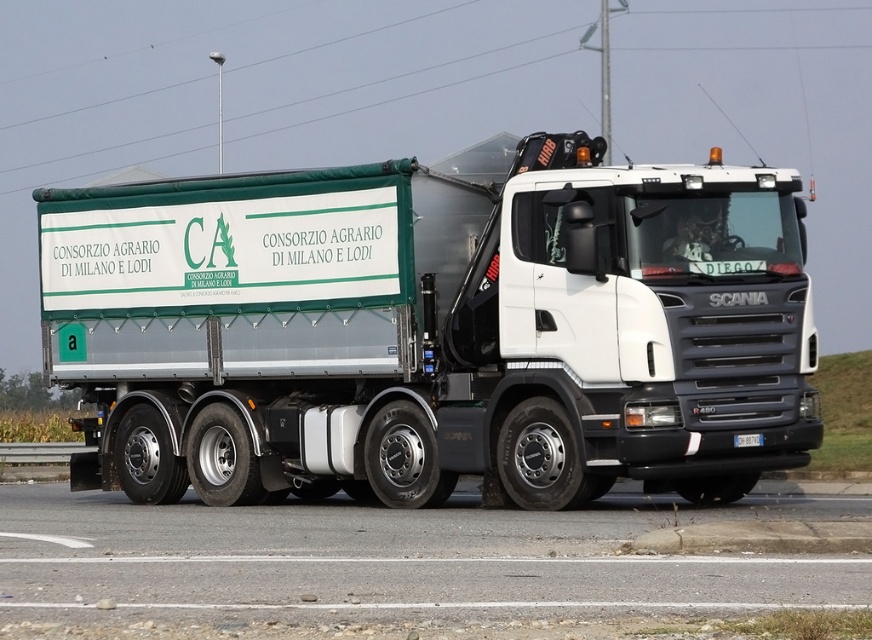
Who is positioned more to the right, white metallic trailer truck at center or gray asphalt road at lower center?

gray asphalt road at lower center is more to the right.

Looking at this image, is white metallic trailer truck at center smaller than gray asphalt road at lower center?

No, white metallic trailer truck at center is not smaller than gray asphalt road at lower center.

Measure the distance between point (591, 168) and camera.

14.75 meters

This screenshot has height=640, width=872. Identify the location of white metallic trailer truck at center. (436, 328).